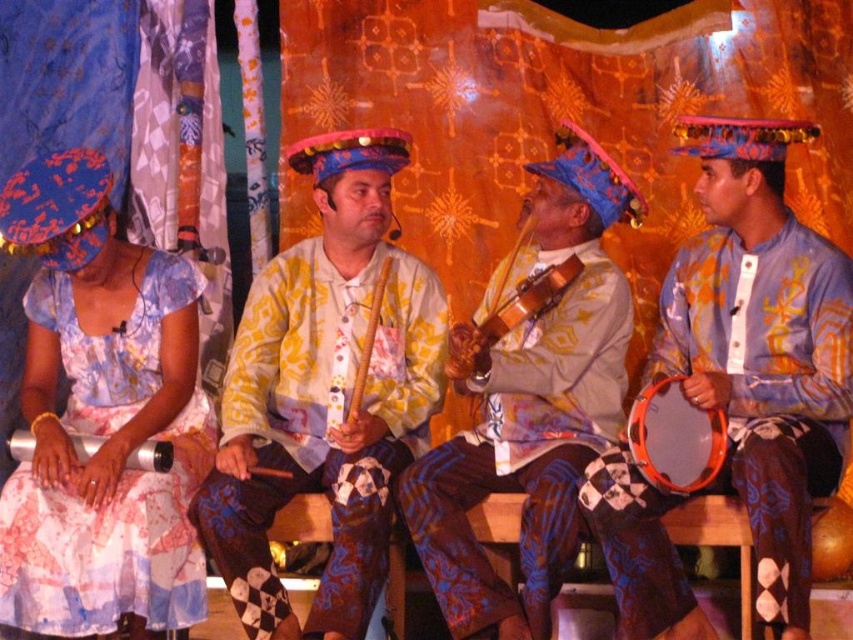
Question: Which of the following is the farthest from the observer?

Choices:
 (A) matte blue drum at right
 (B) matte floral dress at left
 (C) orange plastic drum at lower right

Answer: (C)

Question: Which object is positioned closest to the matte yellow shirt at center?

Choices:
 (A) metallic drum at lower left
 (B) matte floral dress at left
 (C) orange plastic drum at lower right

Answer: (C)

Question: Among these points, which one is farthest from the camera?

Choices:
 (A) (566, 273)
 (B) (74, 378)

Answer: (A)

Question: In this image, where is matte floral dress at left located relative to metallic drum at lower left?

Choices:
 (A) below
 (B) above

Answer: (B)

Question: Can you confirm if matte floral dress at left is bigger than matte yellow shirt at center?

Choices:
 (A) yes
 (B) no

Answer: (B)

Question: Is matte yellow and white shirt at center closer to camera compared to metallic drum at lower left?

Choices:
 (A) yes
 (B) no

Answer: (A)